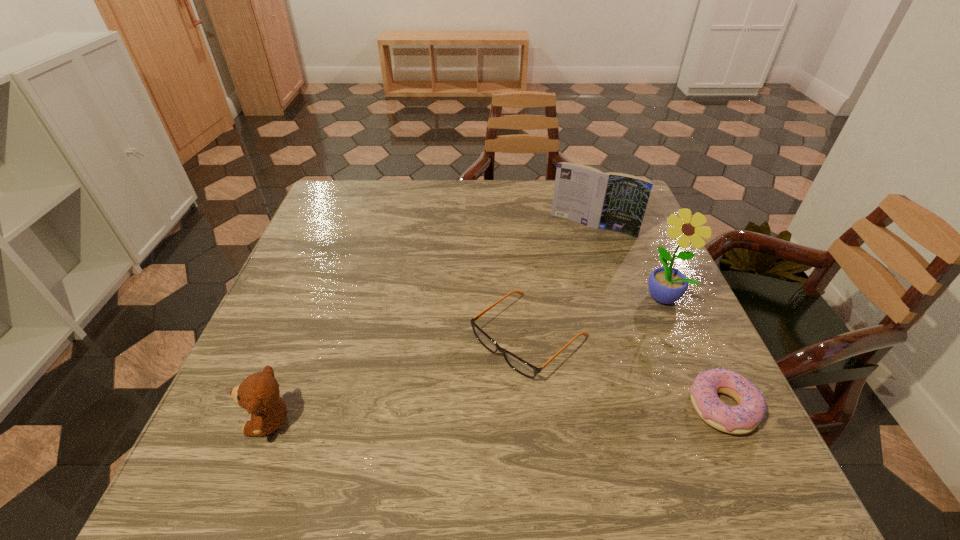
Identify the location of doughnut that is at the near edge. (743, 418).

Identify the location of object that is at the left edge. The image size is (960, 540). (259, 393).

Identify the location of doughnut positioned at the right edge. (743, 418).

Where is `sunflower present at the right edge`? sunflower present at the right edge is located at coordinates (666, 285).

Identify the location of book present at the right edge. (613, 201).

The height and width of the screenshot is (540, 960). Identify the location of object present at the near left corner. (259, 393).

This screenshot has height=540, width=960. I want to click on object that is at the far right corner, so click(613, 201).

In order to click on object situated at the near right corner in this screenshot , I will do `click(743, 418)`.

I want to click on vacant point at the far edge, so click(x=476, y=179).

This screenshot has height=540, width=960. In order to click on free space at the near edge of the desktop in this screenshot , I will do `click(497, 430)`.